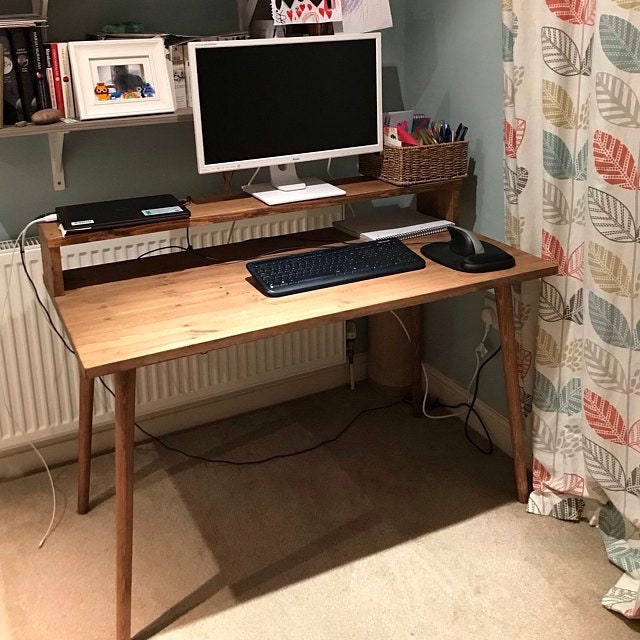
This screenshot has height=640, width=640. Find the location of `pens`. pens is located at coordinates (417, 134).